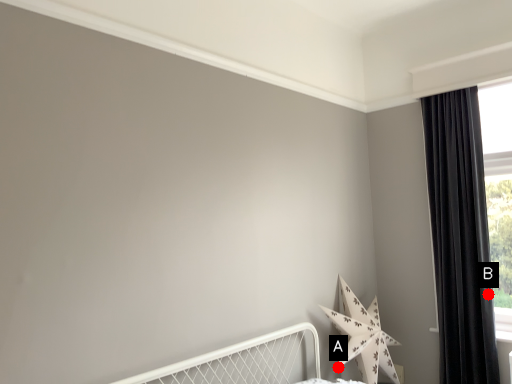
Question: Two points are circled on the image, labeled by A and B beside each circle. Which point appears farthest from the camera in this image?

Choices:
 (A) A is further
 (B) B is further

Answer: (A)